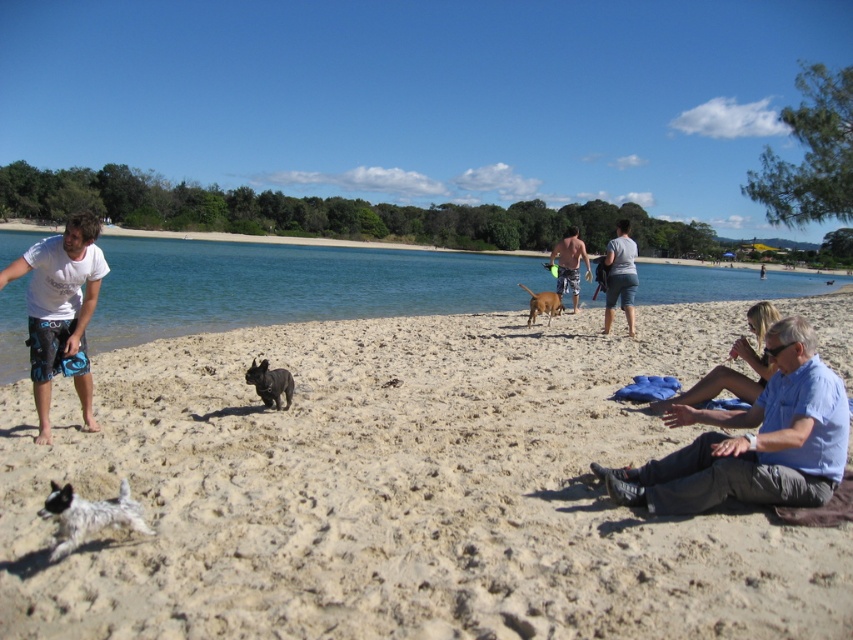
Question: Which point is farther to the camera?

Choices:
 (A) denim shorts at center
 (B) black matte dog at center
 (C) blue shirt at lower right
 (D) fine-grained sand at center

Answer: (A)

Question: From the image, what is the correct spatial relationship of fine-grained sand at center in relation to skinny man at center?

Choices:
 (A) below
 (B) above

Answer: (A)

Question: Which point appears closest to the camera in this image?

Choices:
 (A) (258, 381)
 (B) (302, 310)
 (C) (56, 324)
 (D) (496, 474)

Answer: (D)

Question: Can you confirm if blue shirt at lower right is positioned below black matte dog at center?

Choices:
 (A) no
 (B) yes

Answer: (B)

Question: Which point is closer to the camera?

Choices:
 (A) white cotton t-shirt at left
 (B) blue shirt at lower right
 (C) black matte dog at center
 (D) fine-grained sand at center

Answer: (D)

Question: Does fine-grained sand at center come in front of denim shorts at center?

Choices:
 (A) yes
 (B) no

Answer: (A)